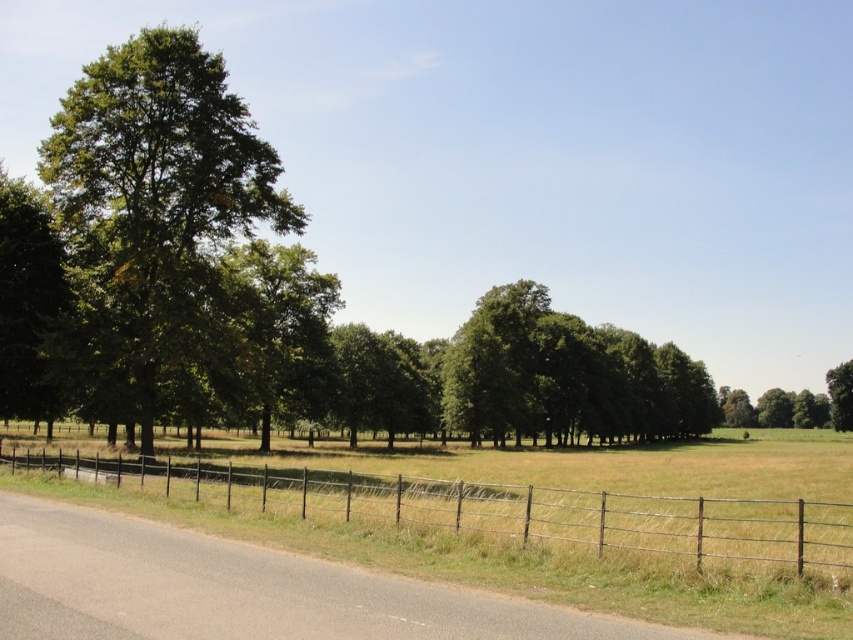
Can you confirm if metallic wire fence at lower center is bigger than green leafy tree at right?

No, metallic wire fence at lower center is not bigger than green leafy tree at right.

Between point (393, 492) and point (846, 371), which one is positioned behind?

Positioned behind is point (846, 371).

Where is `metallic wire fence at lower center`? metallic wire fence at lower center is located at coordinates (490, 508).

Can you confirm if green leafy tree at left is taller than green leafy tree at right?

Yes.

Who is shorter, green leafy tree at left or green leafy tree at right?

With less height is green leafy tree at right.

Between point (160, 224) and point (851, 376), which one is positioned behind?

Point (851, 376)

Identify the location of green leafy tree at left. (155, 198).

What do you see at coordinates (155, 198) in the screenshot?
I see `green leafy tree at left` at bounding box center [155, 198].

You are a GUI agent. You are given a task and a screenshot of the screen. Output one action in this format:
    pyautogui.click(x=<x>, y=<y>)
    Task: Click on the green leafy tree at left
    
    Given the screenshot: What is the action you would take?
    pyautogui.click(x=155, y=198)